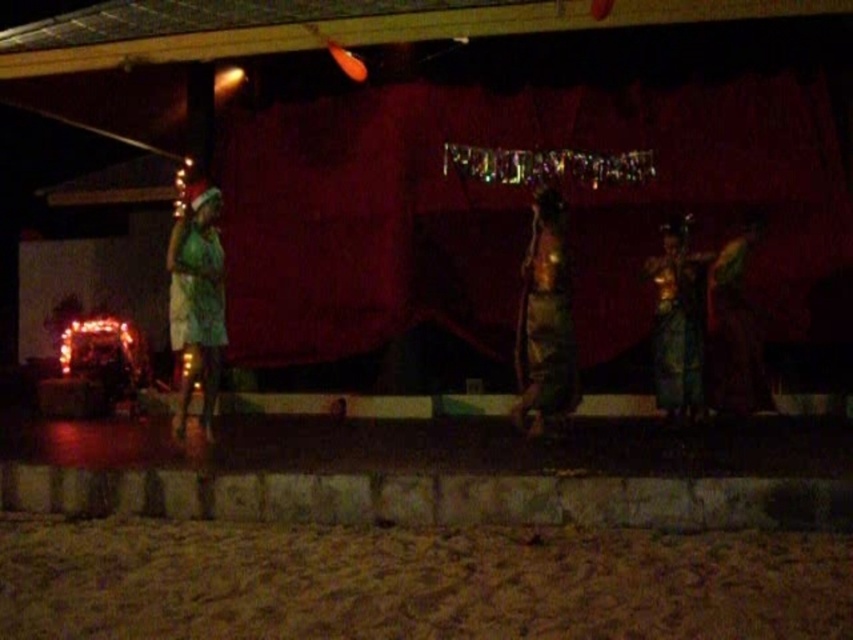
You are an event photographer positioned at the back of the audience area. You want to capture a photo of both the metallic gold statue at center and the green silk dress at center in the same frame. Based on their positions, which object should you adjust your camera focus to first to ensure both are in the frame?

The metallic gold statue at center is to the left of the green silk dress at center. To include both in the frame, adjust your camera focus to the metallic gold statue at center first since it is positioned further left, ensuring there is enough space to include the green silk dress at center on the right side.

You are an event coordinator arranging seating for the audience. You need to place chairs in front of the stage so that attendees can see both the green fabric dress at left and the green silk dress at center clearly. Considering their sizes, which dress might block the view of the other if positioned closer to the front of the stage?

The green silk dress at center is thicker than the green fabric dress at left, so if placed closer to the front, it might block the view of the thinner green fabric dress at left.